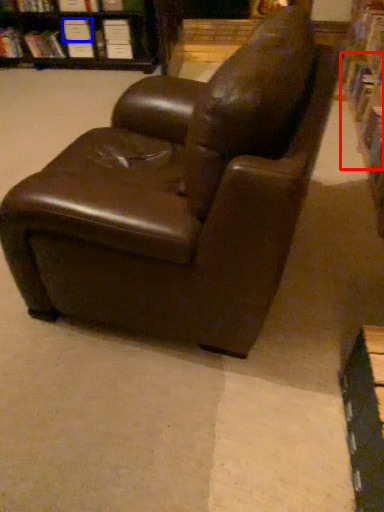
Question: Which object appears farthest to the camera in this image, book (highlighted by a red box) or paperback book (highlighted by a blue box)?

Choices:
 (A) book
 (B) paperback book

Answer: (B)